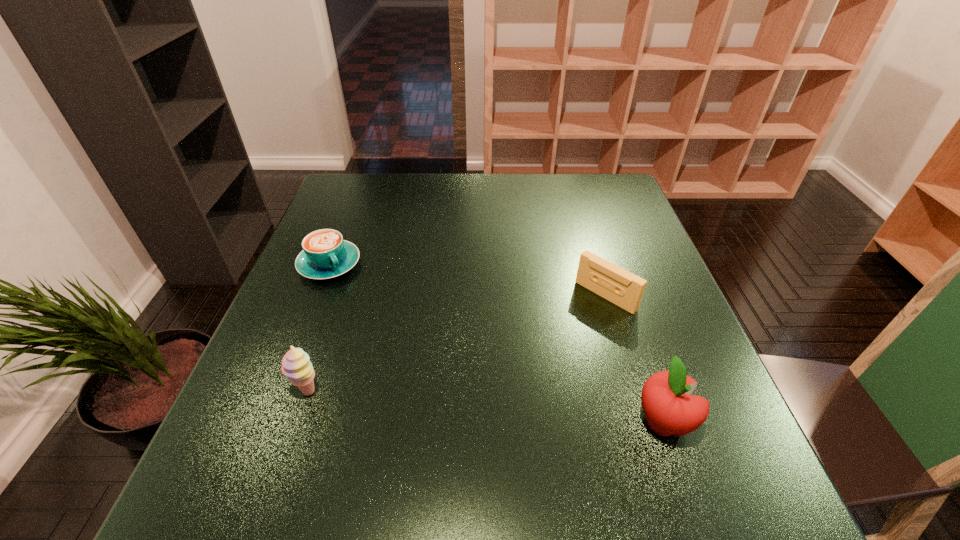
This screenshot has height=540, width=960. What are the coordinates of `free space on the desktop that is between the sherbert and the apple and is positioned with the handle on the right side of the shortest object` in the screenshot? It's located at (428, 402).

You are a GUI agent. You are given a task and a screenshot of the screen. Output one action in this format:
    pyautogui.click(x=<x>, y=<y>)
    Task: Click on the free space on the desktop that is between the sherbert and the apple and is positioned at the front of the third tallest object with spools
    This screenshot has height=540, width=960.
    Given the screenshot: What is the action you would take?
    pyautogui.click(x=488, y=407)